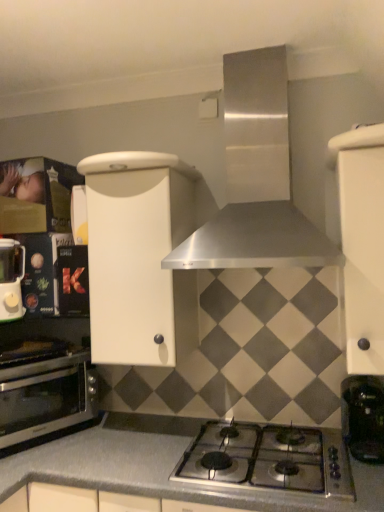
Question: In terms of size, does stainless steel range hood at upper center appear bigger or smaller than black plastic coffee machine at lower right?

Choices:
 (A) small
 (B) big

Answer: (B)

Question: Is point pos(269,131) closer or farther from the camera than point pos(362,400)?

Choices:
 (A) farther
 (B) closer

Answer: (A)

Question: Which object is positioned farthest from the gray matte countertop at lower center?

Choices:
 (A) matte white blender at left
 (B) white matte cabinet at right, which is counted as the 2th cabinetry, starting from the left
 (C) polished stainless steel gas stove at center
 (D) stainless steel oven at lower left
 (E) white matte cabinet at center, acting as the 2th cabinetry starting from the right

Answer: (B)

Question: Which is farther from the gray matte countertop at lower center?

Choices:
 (A) matte white blender at left
 (B) stainless steel range hood at upper center
 (C) white matte cabinet at right, which ranks as the first cabinetry in right-to-left order
 (D) white matte cabinet at center, which is counted as the first cabinetry, starting from the left
 (E) black plastic coffee machine at lower right

Answer: (B)